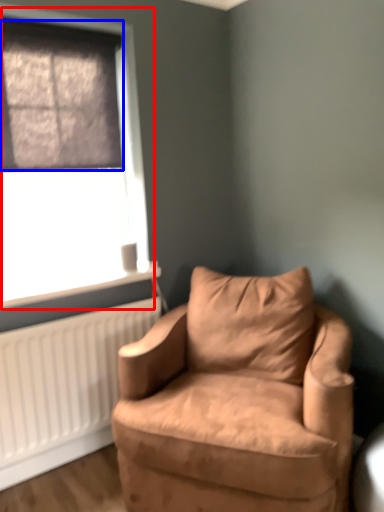
Question: Which of the following is the farthest to the observer, window (highlighted by a red box) or window screen (highlighted by a blue box)?

Choices:
 (A) window
 (B) window screen

Answer: (A)